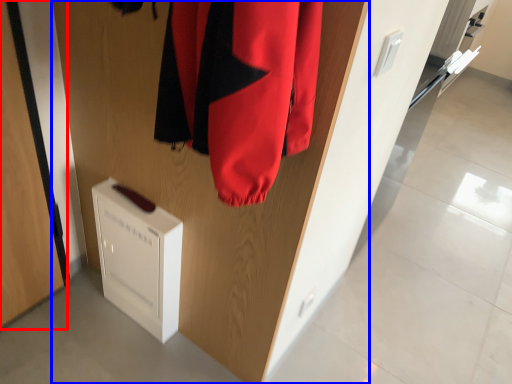
Question: Which point is further to the camera, door (highlighted by a red box) or door (highlighted by a blue box)?

Choices:
 (A) door
 (B) door

Answer: (A)